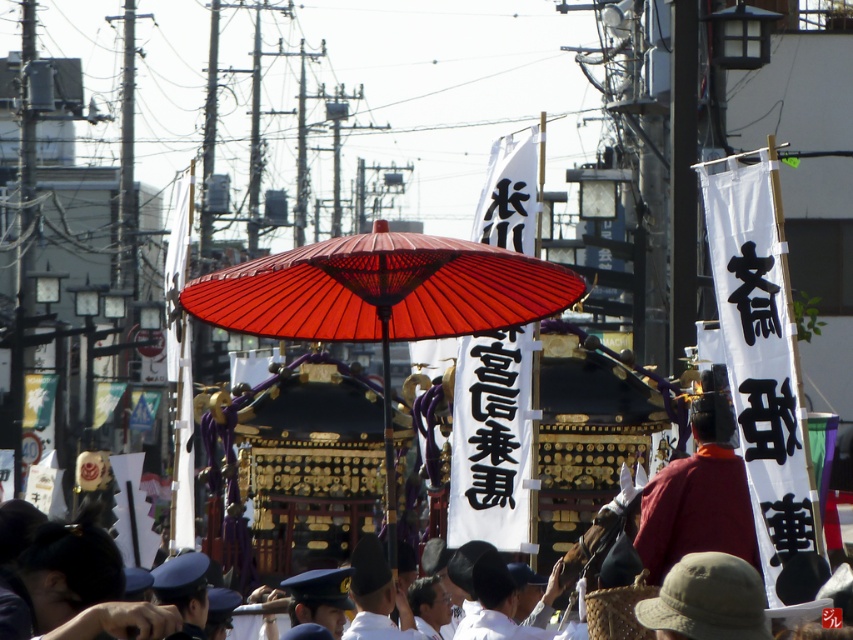
Question: Is matte red parasol at center below red velvet hat at center?

Choices:
 (A) yes
 (B) no

Answer: (B)

Question: Can you confirm if matte red parasol at center is smaller than red velvet hat at center?

Choices:
 (A) no
 (B) yes

Answer: (A)

Question: Which point is farther from the camera taking this photo?

Choices:
 (A) (672, 524)
 (B) (502, 317)

Answer: (B)

Question: Is matte red parasol at center smaller than red velvet hat at center?

Choices:
 (A) no
 (B) yes

Answer: (A)

Question: Which of the following is the farthest from the observer?

Choices:
 (A) matte red parasol at center
 (B) red velvet hat at center

Answer: (B)

Question: Which of the following is the farthest from the observer?

Choices:
 (A) red velvet hat at center
 (B) matte red parasol at center

Answer: (A)